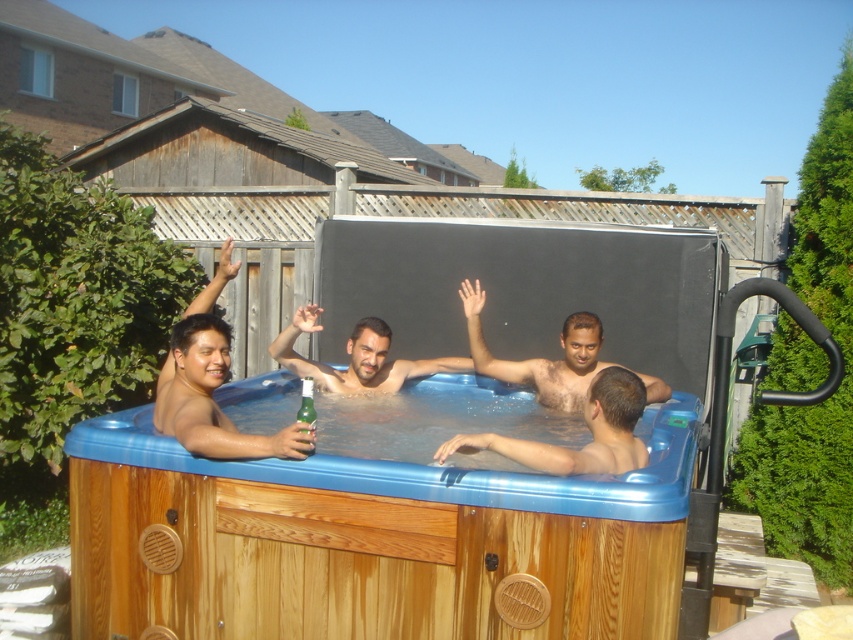
You are standing outside the wooden hot tub at center and want to toss a beach ball into it. If the ball travels in a straight line, will it land inside the hot tub?

The wooden hot tub at center is 2.25 meters away from you. Since the ball travels in a straight line, it will land inside the hot tub if aimed correctly.

You are a photographer standing near the hot tub. You want to take a photo that includes both the brown skin at center and the green matte bottle at center. Based on their positions, which object should appear higher in the photo?

The brown skin at center is above the green matte bottle at center, so it will appear higher in the photo.

You are a photographer taking a picture of the brown skin at center and the green matte bottle at center. Which object will appear larger in the photo?

The brown skin at center will appear larger in the photo since it is bigger than the green matte bottle at center.